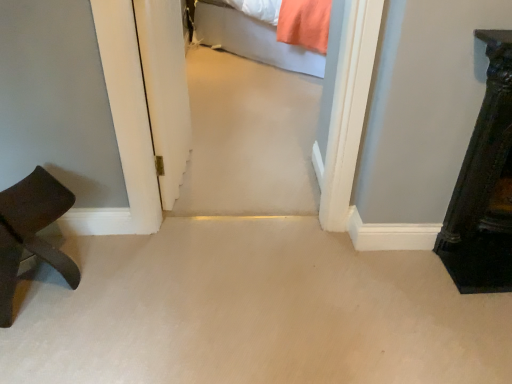
The image size is (512, 384). Identify the location of vacant space in between dark wood dresser at right, positioned as the first furniture in right-to-left order, and dark brown wood stool at left, which is counted as the 2th furniture, starting from the right. (218, 269).